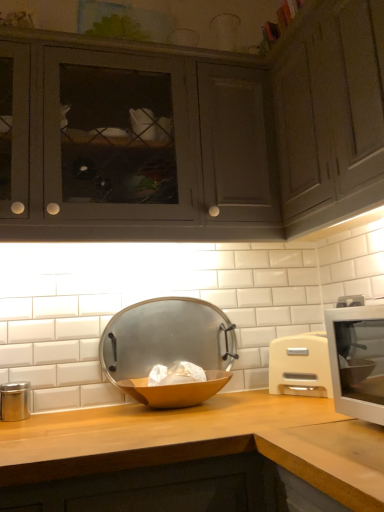
Question: Does wooden at center lie in front of white plastic microwave at right?

Choices:
 (A) no
 (B) yes

Answer: (B)

Question: Is wooden at center positioned behind white plastic microwave at right?

Choices:
 (A) no
 (B) yes

Answer: (A)

Question: Does wooden at center have a smaller size compared to white plastic microwave at right?

Choices:
 (A) no
 (B) yes

Answer: (A)

Question: Is wooden at center with white plastic microwave at right?

Choices:
 (A) no
 (B) yes

Answer: (A)

Question: From a real-world perspective, is wooden at center below white plastic microwave at right?

Choices:
 (A) yes
 (B) no

Answer: (A)

Question: Can you confirm if wooden at center is bigger than white plastic microwave at right?

Choices:
 (A) yes
 (B) no

Answer: (A)

Question: Considering the relative sizes of white plastic microwave at right and wooden bowl at center in the image provided, is white plastic microwave at right thinner than wooden bowl at center?

Choices:
 (A) yes
 (B) no

Answer: (A)

Question: Are white plastic microwave at right and wooden bowl at center making contact?

Choices:
 (A) yes
 (B) no

Answer: (B)

Question: Is white plastic microwave at right positioned behind wooden bowl at center?

Choices:
 (A) yes
 (B) no

Answer: (A)

Question: From a real-world perspective, is white plastic microwave at right physically below wooden bowl at center?

Choices:
 (A) no
 (B) yes

Answer: (A)

Question: Considering the relative sizes of white plastic microwave at right and wooden bowl at center in the image provided, is white plastic microwave at right bigger than wooden bowl at center?

Choices:
 (A) yes
 (B) no

Answer: (B)

Question: From the image's perspective, is white plastic microwave at right below wooden bowl at center?

Choices:
 (A) no
 (B) yes

Answer: (A)

Question: Is matte gray cabinets at upper left, the 2th cabinetry viewed from the right, bigger than wooden bowl at center?

Choices:
 (A) yes
 (B) no

Answer: (A)